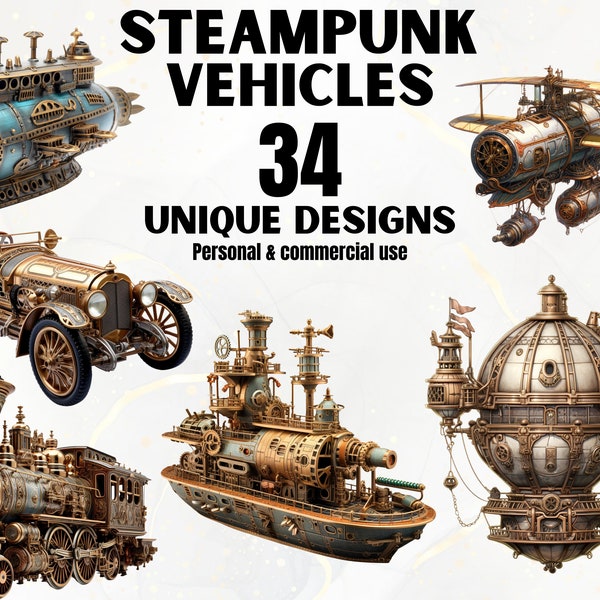
What are the coordinates of `lights` in the screenshot? It's located at (94, 306), (145, 299).